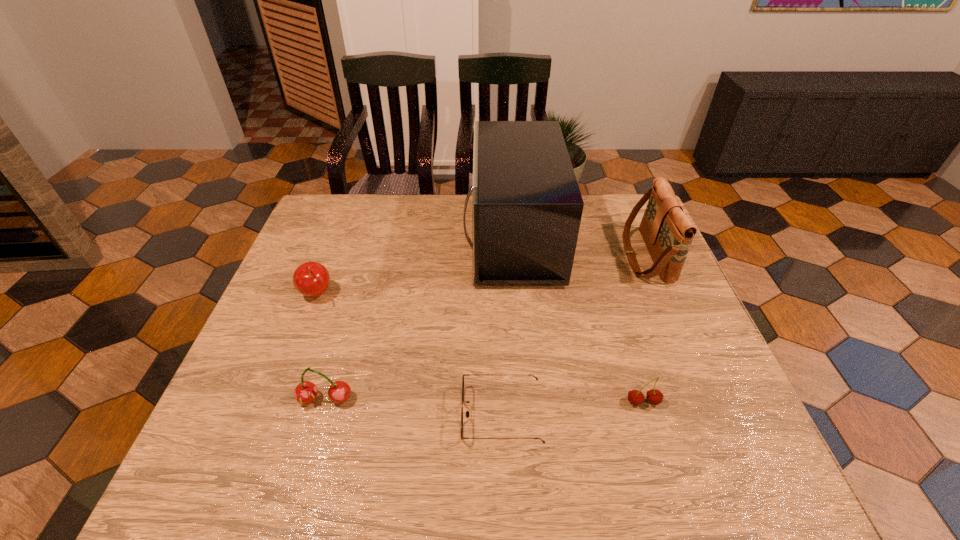
Find the location of `vacant space at the right edge of the desktop`. vacant space at the right edge of the desktop is located at coordinates (659, 278).

The height and width of the screenshot is (540, 960). In the image, there is a desktop. What are the coordinates of `free space at the far left corner` in the screenshot? It's located at (331, 196).

Locate an element on the screen. This screenshot has width=960, height=540. vacant space at the near left corner is located at coordinates (200, 458).

Where is `free space at the far right corner of the desktop`? Image resolution: width=960 pixels, height=540 pixels. free space at the far right corner of the desktop is located at coordinates tap(597, 203).

Find the location of a particular element. blank region between the second shortest object and the farthest cherry is located at coordinates (479, 348).

Locate an element on the screen. The image size is (960, 540). vacant area that lies between the farthest cherry and the tallest object is located at coordinates (414, 266).

This screenshot has height=540, width=960. What are the coordinates of `vacant space that is in between the tallest object and the shoulder bag` in the screenshot? It's located at (579, 247).

The width and height of the screenshot is (960, 540). Find the location of `empty space that is in between the leftmost object and the rightmost cherry`. empty space that is in between the leftmost object and the rightmost cherry is located at coordinates (479, 348).

Image resolution: width=960 pixels, height=540 pixels. In order to click on free space between the microwave oven and the shortest object in this screenshot , I will do `click(507, 326)`.

This screenshot has width=960, height=540. I want to click on free space between the second tallest object and the second object from left to right, so click(x=486, y=328).